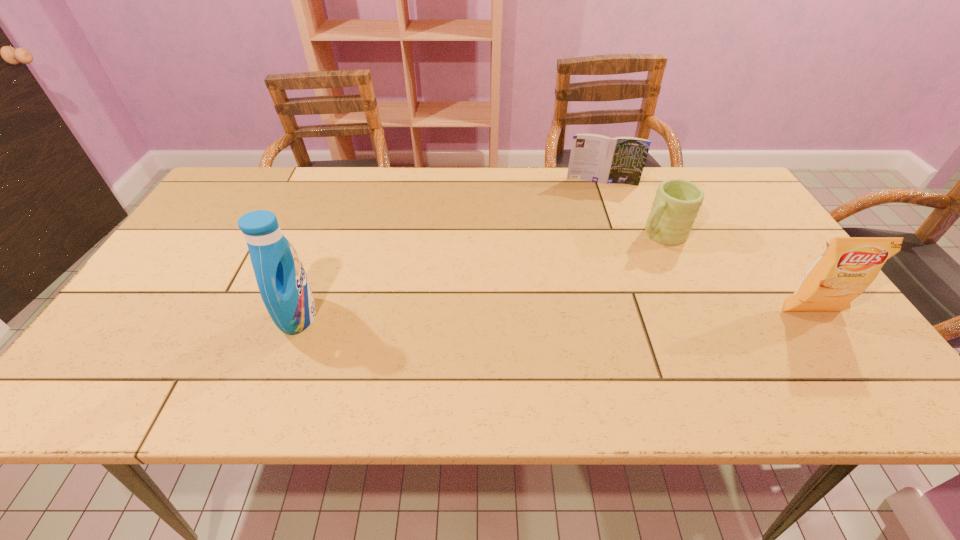
You are a GUI agent. You are given a task and a screenshot of the screen. Output one action in this format:
    pyautogui.click(x=<x>, y=<y>)
    Task: Click on the free space between the crisp (potato chip) and the tallest object
    
    Given the screenshot: What is the action you would take?
    pyautogui.click(x=555, y=314)

Where is `empty space between the leftmost object and the farthest object`? empty space between the leftmost object and the farthest object is located at coordinates (450, 249).

Select which object appears as the third closest to the third shortest object. Please provide its 2D coordinates. Your answer should be formatted as a tuple, i.e. [(x, y)], where the tuple contains the x and y coordinates of a point satisfying the conditions above.

[(282, 281)]

Locate which object is the third closest to the rightmost object. Please provide its 2D coordinates. Your answer should be formatted as a tuple, i.e. [(x, y)], where the tuple contains the x and y coordinates of a point satisfying the conditions above.

[(282, 281)]